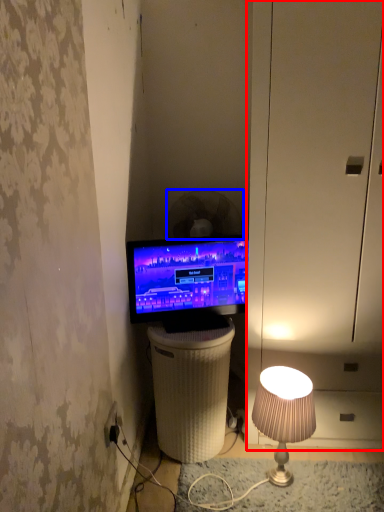
Question: Among these objects, which one is farthest to the camera, dresser (highlighted by a red box) or mechanical fan (highlighted by a blue box)?

Choices:
 (A) dresser
 (B) mechanical fan

Answer: (B)